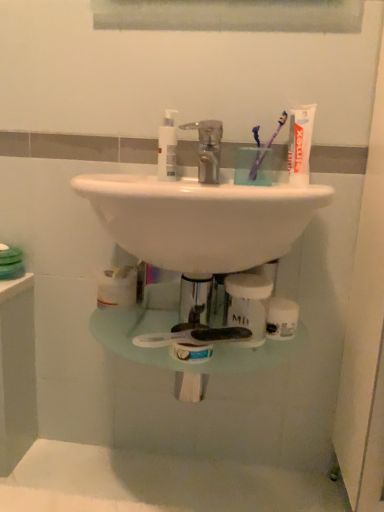
What do you see at coordinates (247, 305) in the screenshot? I see `clear plastic jar at center, the 1th toiletry positioned from the right` at bounding box center [247, 305].

What is the approximate height of clear plastic jar at center, which is the second toiletry in top-to-bottom order?

clear plastic jar at center, which is the second toiletry in top-to-bottom order, is 13.26 centimeters in height.

Where is `polished chrome faucet at center`? polished chrome faucet at center is located at coordinates (207, 149).

What do you see at coordinates (266, 148) in the screenshot? I see `purple plastic toothbrush at upper right, which is the 1th toothbrush in right-to-left order` at bounding box center [266, 148].

Where is `clear plastic jar at center, acting as the 1th toiletry starting from the bottom`? The image size is (384, 512). clear plastic jar at center, acting as the 1th toiletry starting from the bottom is located at coordinates (247, 305).

Which object is further away from the camera taking this photo, white plastic pump bottle at center, which ranks as the 2th toiletry in right-to-left order, or polished chrome faucet at center?

white plastic pump bottle at center, which ranks as the 2th toiletry in right-to-left order, is more distant.

How different are the orientations of white plastic pump bottle at center, the second toiletry when ordered from bottom to top, and polished chrome faucet at center in degrees?

1.52 degrees.

Is polished chrome faucet at center surrounded by white plastic pump bottle at center, which ranks as the 2th toiletry in right-to-left order?

No, polished chrome faucet at center is not surrounded by white plastic pump bottle at center, which ranks as the 2th toiletry in right-to-left order.

Does white plastic pump bottle at center, which is counted as the 1th toiletry, starting from the left, have a lesser height compared to polished chrome faucet at center?

In fact, white plastic pump bottle at center, which is counted as the 1th toiletry, starting from the left, may be taller than polished chrome faucet at center.

From a real-world perspective, between white matte tube of toothpaste at upper right and purple plastic toothbrush at upper right, which ranks as the second toothbrush in left-to-right order, who is vertically higher?

white matte tube of toothpaste at upper right is physically above.

From the image's perspective, is white matte tube of toothpaste at upper right above purple plastic toothbrush at upper right, which is the 1th toothbrush in right-to-left order?

Actually, white matte tube of toothpaste at upper right appears below purple plastic toothbrush at upper right, which is the 1th toothbrush in right-to-left order, in the image.

Identify the location of the 1st toothbrush to the left of the white matte tube of toothpaste at upper right, starting your count from the anchor. (266, 148).

From the image's perspective, is white glossy sink at center located above or below polished chrome faucet at center?

white glossy sink at center is below polished chrome faucet at center.

Is point (156, 232) positioned before point (196, 127)?

That is True.

Based on their sizes in the image, would you say white glossy sink at center is bigger or smaller than polished chrome faucet at center?

white glossy sink at center is bigger than polished chrome faucet at center.

Would you say white glossy sink at center is outside polished chrome faucet at center?

Yes, white glossy sink at center is outside of polished chrome faucet at center.

Can you confirm if purple translucent toothbrush at upper center, the 1th toothbrush viewed from the left, is wider than clear plastic jar at center, which is the second toiletry in top-to-bottom order?

No.

Based on the photo, does purple translucent toothbrush at upper center, the 1th toothbrush viewed from the left, come behind clear plastic jar at center, the 1th toiletry positioned from the right?

Yes, it is.

Can you confirm if purple translucent toothbrush at upper center, which is the 2th toothbrush in right-to-left order, is bigger than clear plastic jar at center, which is the second toiletry from left to right?

Incorrect, purple translucent toothbrush at upper center, which is the 2th toothbrush in right-to-left order, is not larger than clear plastic jar at center, which is the second toiletry from left to right.

From the image's perspective, does purple translucent toothbrush at upper center, the 1th toothbrush viewed from the left, appear higher than clear plastic jar at center, which is the second toiletry in top-to-bottom order?

Correct, purple translucent toothbrush at upper center, the 1th toothbrush viewed from the left, appears higher than clear plastic jar at center, which is the second toiletry in top-to-bottom order, in the image.

Considering the relative sizes of white glossy sink at center and clear plastic jar at center, acting as the 1th toiletry starting from the bottom, in the image provided, is white glossy sink at center thinner than clear plastic jar at center, acting as the 1th toiletry starting from the bottom,?

No, white glossy sink at center is not thinner than clear plastic jar at center, acting as the 1th toiletry starting from the bottom.

Looking at the image, does white glossy sink at center seem bigger or smaller compared to clear plastic jar at center, which is the second toiletry in top-to-bottom order?

Considering their sizes, white glossy sink at center takes up more space than clear plastic jar at center, which is the second toiletry in top-to-bottom order.

From the image's perspective, who appears lower, white glossy sink at center or clear plastic jar at center, which is the second toiletry in top-to-bottom order?

clear plastic jar at center, which is the second toiletry in top-to-bottom order, appears lower in the image.

How different are the orientations of white glossy sink at center and clear plastic jar at center, the 1th toiletry positioned from the right, in degrees?

The angular difference between white glossy sink at center and clear plastic jar at center, the 1th toiletry positioned from the right, is 2.79 degrees.

Is white glossy sink at center far from white plastic pump bottle at center, which ranks as the 2th toiletry in right-to-left order?

Actually, white glossy sink at center and white plastic pump bottle at center, which ranks as the 2th toiletry in right-to-left order, are a little close together.

Based on the photo, can you confirm if white glossy sink at center is smaller than white plastic pump bottle at center, the 1th toiletry from the top?

Incorrect, white glossy sink at center is not smaller in size than white plastic pump bottle at center, the 1th toiletry from the top.

Which object is wider, white glossy sink at center or white plastic pump bottle at center, which ranks as the 2th toiletry in right-to-left order?

white glossy sink at center.

Between white matte tube of toothpaste at upper right and clear plastic jar at center, which is the second toiletry from left to right, which one has smaller size?

white matte tube of toothpaste at upper right is smaller.

Looking at this image, is clear plastic jar at center, the 1th toiletry positioned from the right, a part of white matte tube of toothpaste at upper right?

No, clear plastic jar at center, the 1th toiletry positioned from the right, is not inside white matte tube of toothpaste at upper right.

From their relative heights in the image, would you say white matte tube of toothpaste at upper right is taller or shorter than clear plastic jar at center, acting as the 1th toiletry starting from the bottom?

white matte tube of toothpaste at upper right is taller than clear plastic jar at center, acting as the 1th toiletry starting from the bottom.

Measure the distance between white matte tube of toothpaste at upper right and clear plastic jar at center, acting as the 1th toiletry starting from the bottom.

white matte tube of toothpaste at upper right and clear plastic jar at center, acting as the 1th toiletry starting from the bottom, are 11.99 inches apart.

Image resolution: width=384 pixels, height=512 pixels. In order to click on tap in front of the white plastic pump bottle at center, the 1th toiletry from the top in this screenshot , I will do `click(207, 149)`.

You are a GUI agent. You are given a task and a screenshot of the screen. Output one action in this format:
    pyautogui.click(x=<x>, y=<y>)
    Task: Click on the toothpaste on the right of purple plastic toothbrush at upper right, which ranks as the second toothbrush in left-to-right order
    
    Given the screenshot: What is the action you would take?
    pyautogui.click(x=300, y=143)

In the scene shown: Looking at the image, which one is located closer to purple translucent toothbrush at upper center, the 1th toothbrush viewed from the left, clear plastic jar at center, acting as the 1th toiletry starting from the bottom, or polished chrome faucet at center?

polished chrome faucet at center is closer to purple translucent toothbrush at upper center, the 1th toothbrush viewed from the left.

Looking at the image, which one is located further to purple translucent toothbrush at upper center, which is the 2th toothbrush in right-to-left order, white glossy sink at center or polished chrome faucet at center?

white glossy sink at center is further to purple translucent toothbrush at upper center, which is the 2th toothbrush in right-to-left order.

Estimate the real-world distances between objects in this image. Which object is further from white plastic pump bottle at center, which ranks as the 2th toiletry in right-to-left order, polished chrome faucet at center or white matte tube of toothpaste at upper right?

white matte tube of toothpaste at upper right.

When comparing their distances from white glossy sink at center, does purple translucent toothbrush at upper center, the 1th toothbrush viewed from the left, or polished chrome faucet at center seem further?

Based on the image, purple translucent toothbrush at upper center, the 1th toothbrush viewed from the left, appears to be further to white glossy sink at center.

When comparing their distances from white glossy sink at center, does white plastic pump bottle at center, which ranks as the 2th toiletry in right-to-left order, or purple plastic toothbrush at upper right, which ranks as the second toothbrush in left-to-right order, seem further?

purple plastic toothbrush at upper right, which ranks as the second toothbrush in left-to-right order.

Estimate the real-world distances between objects in this image. Which object is further from purple translucent toothbrush at upper center, the 1th toothbrush viewed from the left, white matte tube of toothpaste at upper right or polished chrome faucet at center?

polished chrome faucet at center.

When comparing their distances from purple plastic toothbrush at upper right, which is the 1th toothbrush in right-to-left order, does white matte tube of toothpaste at upper right or purple translucent toothbrush at upper center, the 1th toothbrush viewed from the left, seem further?

white matte tube of toothpaste at upper right.

Looking at the image, which one is located closer to white matte tube of toothpaste at upper right, white plastic pump bottle at center, which ranks as the 2th toiletry in right-to-left order, or clear plastic jar at center, which is the second toiletry from left to right?

Based on the image, white plastic pump bottle at center, which ranks as the 2th toiletry in right-to-left order, appears to be nearer to white matte tube of toothpaste at upper right.

Where is `tap that lies between purple plastic toothbrush at upper right, which is the 1th toothbrush in right-to-left order, and clear plastic jar at center, which is the second toiletry from left to right, from top to bottom`? tap that lies between purple plastic toothbrush at upper right, which is the 1th toothbrush in right-to-left order, and clear plastic jar at center, which is the second toiletry from left to right, from top to bottom is located at coordinates (207, 149).

Locate an element on the screen. The height and width of the screenshot is (512, 384). toothpaste between purple translucent toothbrush at upper center, the 1th toothbrush viewed from the left, and clear plastic jar at center, which is the second toiletry in top-to-bottom order, vertically is located at coordinates (300, 143).

Where is `toothpaste between white glossy sink at center and purple plastic toothbrush at upper right, which is the 1th toothbrush in right-to-left order, along the z-axis`? toothpaste between white glossy sink at center and purple plastic toothbrush at upper right, which is the 1th toothbrush in right-to-left order, along the z-axis is located at coordinates (300, 143).

This screenshot has width=384, height=512. What are the coordinates of `tap positioned between white glossy sink at center and purple plastic toothbrush at upper right, which is the 1th toothbrush in right-to-left order, from near to far` in the screenshot? It's located at (207, 149).